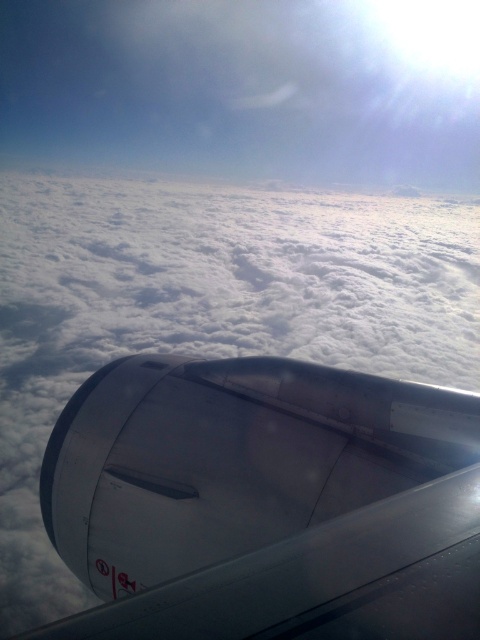
Who is more distant from viewer, (147, 552) or (107, 472)?

The point (107, 472) is behind.

Which is more to the left, metallic jet engine at center or transparent glass airplane window at lower center?

Positioned to the left is transparent glass airplane window at lower center.

Which is in front, point (106, 474) or point (156, 486)?

Point (156, 486) is more forward.

Image resolution: width=480 pixels, height=640 pixels. Identify the location of metallic jet engine at center. (265, 502).